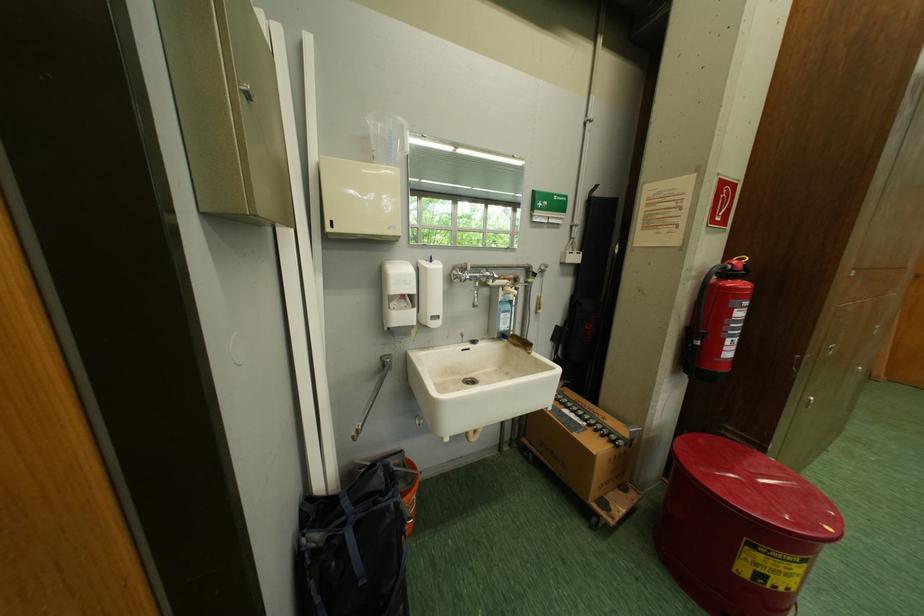
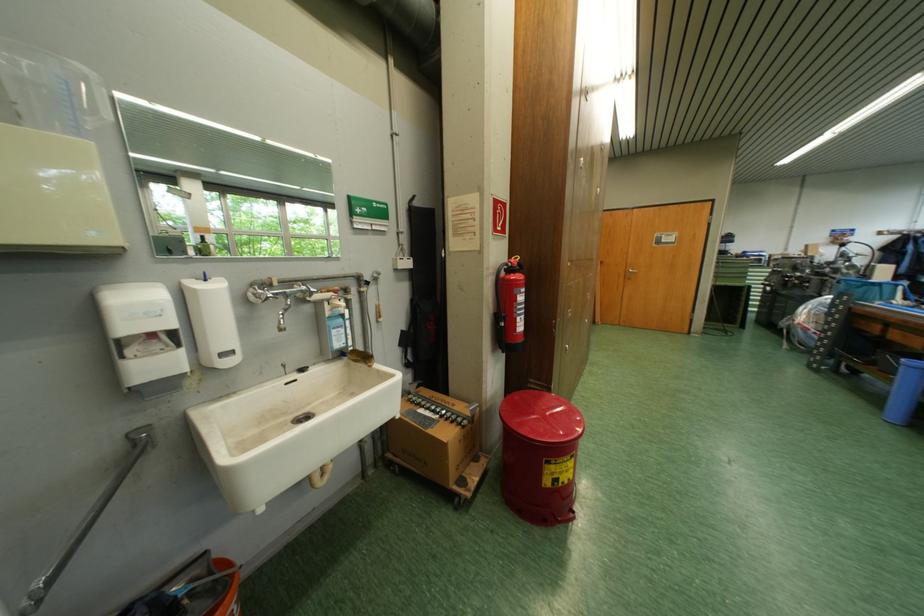
Question: The camera is either moving clockwise (left) or counter-clockwise (right) around the object. The first image is from the beginning of the video and the second image is from the end. Is the camera moving left or right when shooting the video?

Choices:
 (A) Left
 (B) Right

Answer: (A)